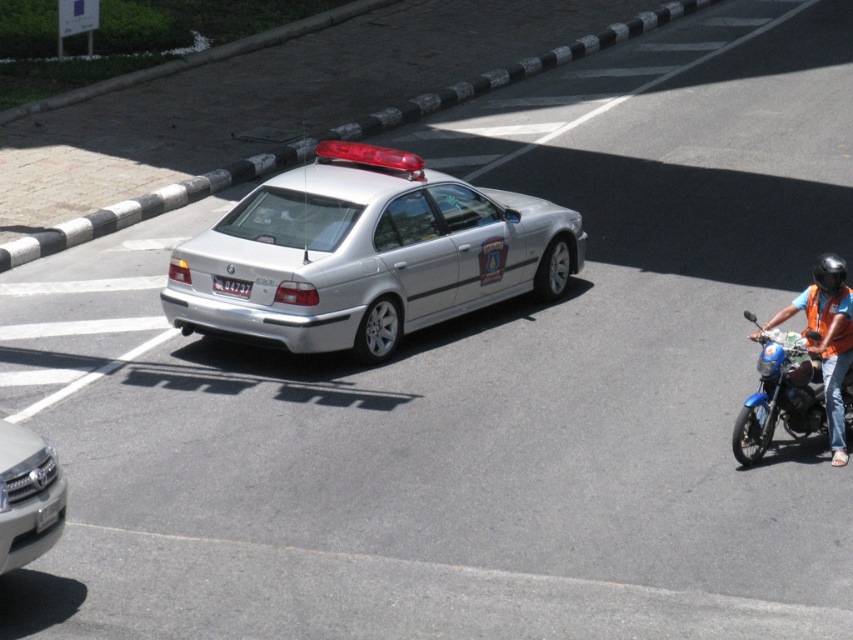
Question: Among these points, which one is farthest from the camera?

Choices:
 (A) (837, 408)
 (B) (546, 204)

Answer: (B)

Question: Can you confirm if silver metallic sedan at center is smaller than satin silver grille at lower left?

Choices:
 (A) no
 (B) yes

Answer: (A)

Question: Does satin silver grille at lower left have a greater width compared to orange reflective vest at right?

Choices:
 (A) no
 (B) yes

Answer: (A)

Question: Which point is farther from the camera taking this photo?

Choices:
 (A) 544,262
 (B) 840,364
 (C) 6,524

Answer: (A)

Question: Among these points, which one is nearest to the camera?

Choices:
 (A) (450, 252)
 (B) (810, 314)

Answer: (B)

Question: Can you confirm if silver metallic sedan at center is wider than black plastic license plate at center?

Choices:
 (A) no
 (B) yes

Answer: (B)